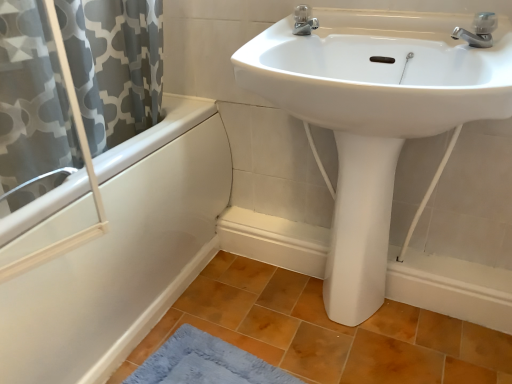
Question: Is silver metallic faucet at upper right, which is counted as the first tap, starting from the right, in contact with white glossy bathtub at left?

Choices:
 (A) no
 (B) yes

Answer: (A)

Question: Is silver metallic faucet at upper right, arranged as the 2th tap when viewed from the left, taller than white glossy bathtub at left?

Choices:
 (A) no
 (B) yes

Answer: (A)

Question: Is silver metallic faucet at upper right, which ranks as the 1th tap in front-to-back order, not close to white glossy bathtub at left?

Choices:
 (A) yes
 (B) no

Answer: (B)

Question: Can you confirm if silver metallic faucet at upper right, arranged as the 2th tap when viewed from the left, is wider than white glossy bathtub at left?

Choices:
 (A) no
 (B) yes

Answer: (A)

Question: From the image's perspective, is silver metallic faucet at upper right, which ranks as the 1th tap in front-to-back order, beneath white glossy bathtub at left?

Choices:
 (A) yes
 (B) no

Answer: (B)

Question: In terms of height, does white glossy sink at upper center look taller or shorter compared to silver metallic faucet at upper center, which appears as the 2th tap when viewed from the right?

Choices:
 (A) short
 (B) tall

Answer: (B)

Question: Would you say white glossy sink at upper center is to the left or to the right of silver metallic faucet at upper center, placed as the 2th tap when sorted from front to back, in the picture?

Choices:
 (A) right
 (B) left

Answer: (A)

Question: Is white glossy sink at upper center inside the boundaries of silver metallic faucet at upper center, placed as the 2th tap when sorted from front to back, or outside?

Choices:
 (A) inside
 (B) outside

Answer: (B)

Question: From the image's perspective, relative to silver metallic faucet at upper center, placed as the 2th tap when sorted from front to back, is white glossy sink at upper center above or below?

Choices:
 (A) above
 (B) below

Answer: (B)

Question: In terms of height, does white glossy bathtub at left look taller or shorter compared to brown matte tile at lower center?

Choices:
 (A) tall
 (B) short

Answer: (A)

Question: From a real-world perspective, is white glossy bathtub at left positioned above or below brown matte tile at lower center?

Choices:
 (A) below
 (B) above

Answer: (B)

Question: Considering the positions of white glossy bathtub at left and brown matte tile at lower center in the image, is white glossy bathtub at left bigger or smaller than brown matte tile at lower center?

Choices:
 (A) small
 (B) big

Answer: (B)

Question: In terms of width, does white glossy bathtub at left look wider or thinner when compared to brown matte tile at lower center?

Choices:
 (A) wide
 (B) thin

Answer: (B)

Question: Considering the positions of silver metallic faucet at upper right, which is counted as the first tap, starting from the right, and silver metallic faucet at upper center, marked as the 1th tap in a left-to-right arrangement, in the image, is silver metallic faucet at upper right, which is counted as the first tap, starting from the right, taller or shorter than silver metallic faucet at upper center, marked as the 1th tap in a left-to-right arrangement,?

Choices:
 (A) tall
 (B) short

Answer: (B)

Question: From the image's perspective, is silver metallic faucet at upper right, placed as the 2th tap when sorted from back to front, located above or below silver metallic faucet at upper center, placed as the 2th tap when sorted from front to back?

Choices:
 (A) above
 (B) below

Answer: (B)